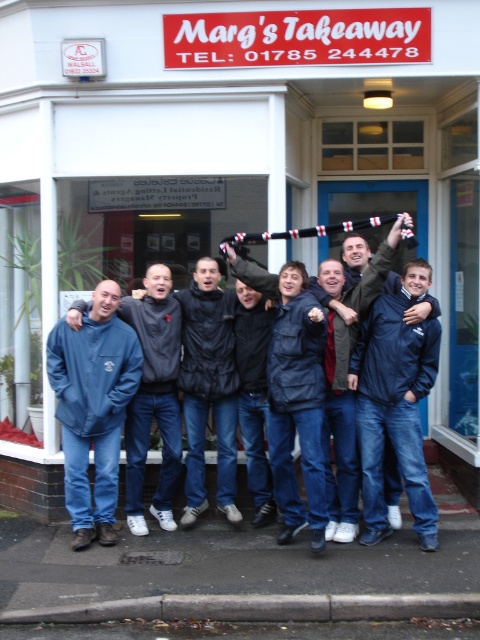
You are a photographer trying to capture a group photo of the navy blue jacket at center and the blue fleece jacket at center. Which person should you focus on first to ensure they are in frame, considering their height?

The navy blue jacket at center is much taller than the blue fleece jacket at center, so you should focus on the navy blue jacket at center first to ensure their full height is captured in the frame.

You are standing at the point marked as point (x=398, y=396). There are two people in the group who are 5.35 meters apart. Can you determine if they are within a 5 meter safety distance recommended during the pandemic?

The two people in the group who are 5.35 meters apart are beyond the recommended 5 meter safety distance.

You are organizing a photoshoot and need to ensure that the two jackets at the center of the image are spaced appropriately. Given that the navy blue jacket at center is wider than the blue fleece jacket at center, which jacket should be positioned closer to the camera to maintain a balanced appearance?

The navy blue jacket at center should be positioned closer to the camera since its width is larger than the blue fleece jacket at center, which will help balance their visual sizes in the photo.